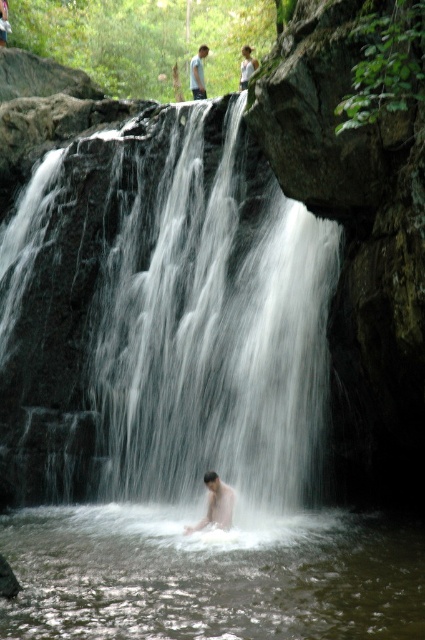
Can you confirm if smooth skin man at center is bigger than light brown skin at upper center?

No.

Which of these two, smooth skin man at center or light brown skin at upper center, stands shorter?

With less height is smooth skin man at center.

You are a GUI agent. You are given a task and a screenshot of the screen. Output one action in this format:
    pyautogui.click(x=<x>, y=<y>)
    Task: Click on the smooth skin man at center
    The width and height of the screenshot is (425, 640).
    Given the screenshot: What is the action you would take?
    pyautogui.click(x=215, y=502)

Where is `smooth skin man at center`? smooth skin man at center is located at coordinates [215, 502].

From the picture: Does clear water at center have a greater width compared to smooth skin man at center?

Indeed, clear water at center has a greater width compared to smooth skin man at center.

In the scene shown: Is clear water at center taller than smooth skin man at center?

No.

Who is more forward, [297,544] or [227,508]?

Point [297,544] is in front.

At what (x,y) coordinates should I click in order to perform the action: click on clear water at center. Please return your answer as a coordinate pair (x, y). The height and width of the screenshot is (640, 425). Looking at the image, I should click on (209, 576).

Is white smooth waterfall at center smaller than white cotton shirt at upper center?

Incorrect, white smooth waterfall at center is not smaller in size than white cotton shirt at upper center.

Does white smooth waterfall at center have a lesser width compared to white cotton shirt at upper center?

In fact, white smooth waterfall at center might be wider than white cotton shirt at upper center.

The image size is (425, 640). In order to click on white smooth waterfall at center in this screenshot , I will do `click(164, 324)`.